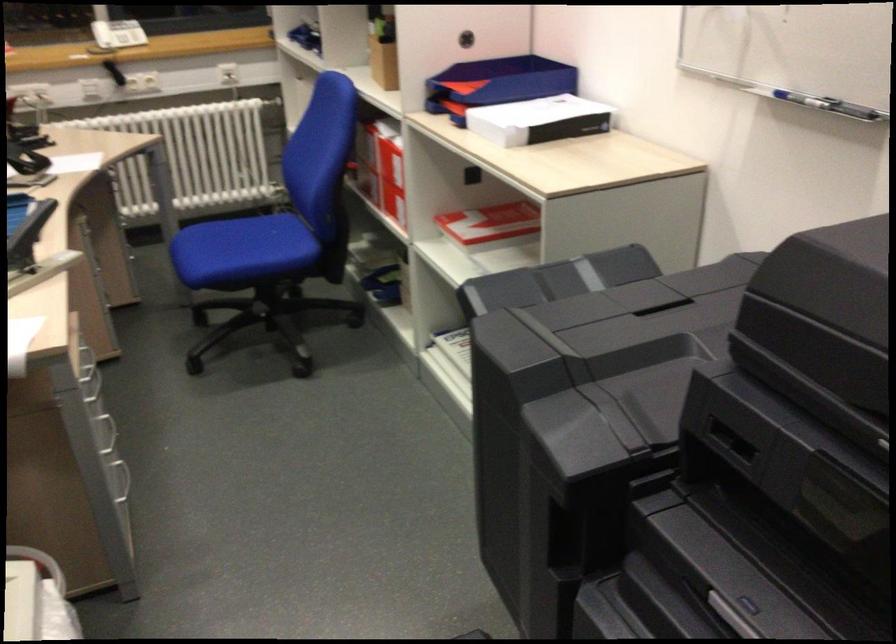
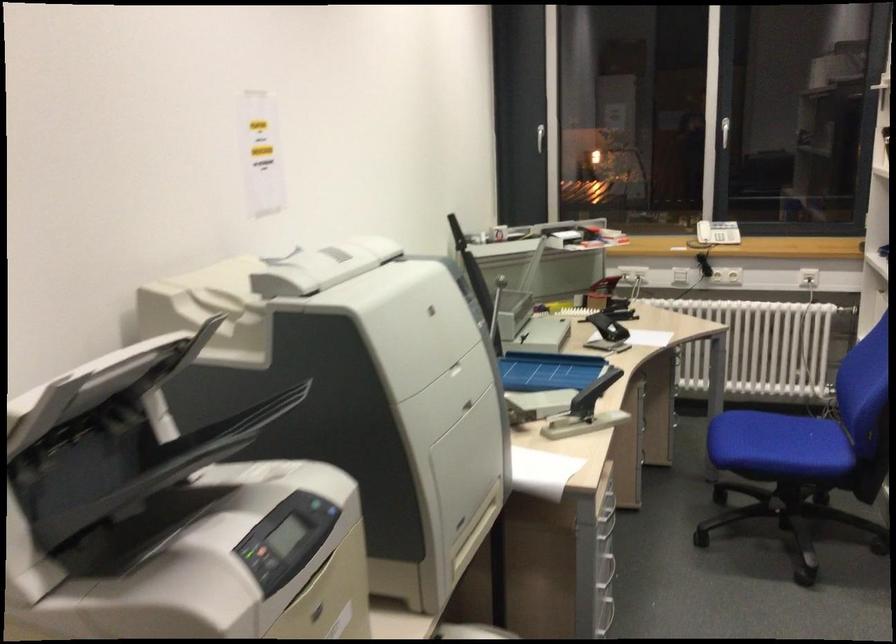
The point at [247,254] is marked in the first image. Where is the corresponding point in the second image?

(778, 446)